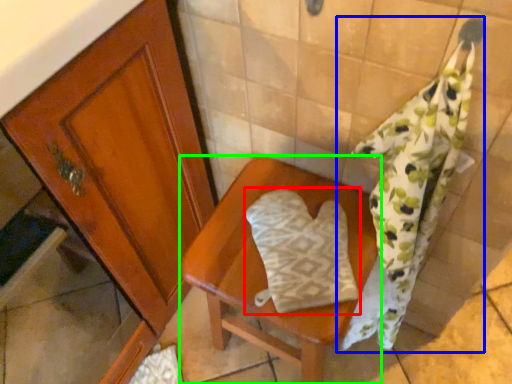
Question: Considering the real-world distances, which object is closest to throw pillow (highlighted by a red box)? bath towel (highlighted by a blue box) or furniture (highlighted by a green box).

Choices:
 (A) bath towel
 (B) furniture

Answer: (B)